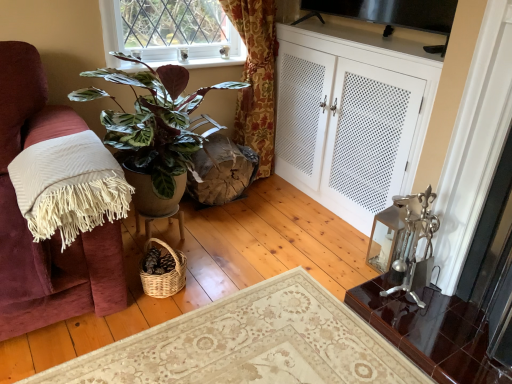
Question: Should I look upward or downward to see green glossy plant at left?

Choices:
 (A) up
 (B) down

Answer: (A)

Question: Should I look upward or downward to see white fringed blanket at left?

Choices:
 (A) down
 (B) up

Answer: (B)

Question: Could you tell me if white fringed blanket at left is facing glossy dark brown desk at lower right?

Choices:
 (A) yes
 (B) no

Answer: (B)

Question: Does white fringed blanket at left have a greater width compared to glossy dark brown desk at lower right?

Choices:
 (A) no
 (B) yes

Answer: (B)

Question: Can you confirm if white fringed blanket at left is positioned to the left of glossy dark brown desk at lower right?

Choices:
 (A) no
 (B) yes

Answer: (B)

Question: Is white fringed blanket at left shorter than glossy dark brown desk at lower right?

Choices:
 (A) no
 (B) yes

Answer: (A)

Question: Is white fringed blanket at left to the right of glossy dark brown desk at lower right from the viewer's perspective?

Choices:
 (A) yes
 (B) no

Answer: (B)

Question: Is white fringed blanket at left taller than glossy dark brown desk at lower right?

Choices:
 (A) yes
 (B) no

Answer: (A)

Question: Is green leafy plant at upper center positioned behind matte brown swivel chair at center?

Choices:
 (A) no
 (B) yes

Answer: (A)

Question: Does green leafy plant at upper center contain matte brown swivel chair at center?

Choices:
 (A) yes
 (B) no

Answer: (B)

Question: Can you confirm if green leafy plant at upper center is shorter than matte brown swivel chair at center?

Choices:
 (A) yes
 (B) no

Answer: (A)

Question: Can you confirm if green leafy plant at upper center is thinner than matte brown swivel chair at center?

Choices:
 (A) no
 (B) yes

Answer: (B)

Question: Is green leafy plant at upper center located outside matte brown swivel chair at center?

Choices:
 (A) no
 (B) yes

Answer: (B)

Question: Considering the relative sizes of green leafy plant at upper center and matte brown swivel chair at center in the image provided, is green leafy plant at upper center bigger than matte brown swivel chair at center?

Choices:
 (A) yes
 (B) no

Answer: (B)

Question: Can you confirm if green leafy plant at upper center is shorter than white fringed blanket at left?

Choices:
 (A) no
 (B) yes

Answer: (B)